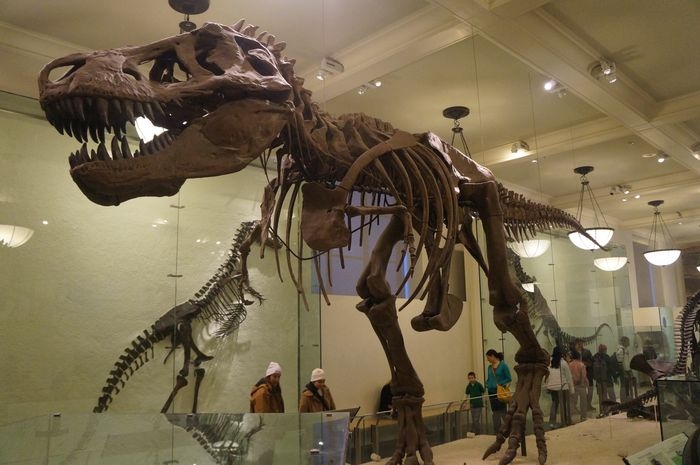
Where is `light fixture`? Image resolution: width=700 pixels, height=465 pixels. light fixture is located at coordinates (598, 238), (668, 255), (458, 110).